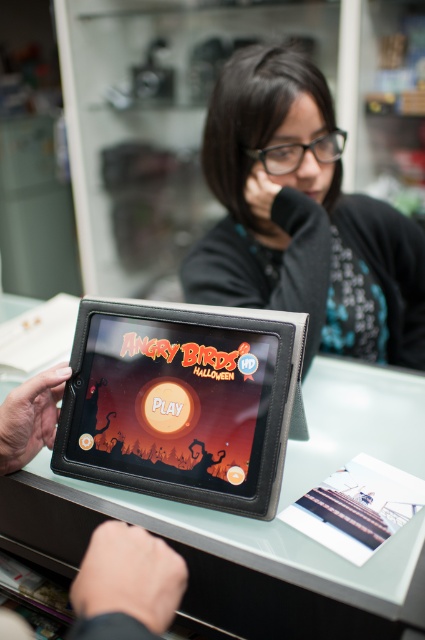
Which is more to the left, black matte jacket at upper center or black leather tablet at center?

From the viewer's perspective, black leather tablet at center appears more on the left side.

Is black matte jacket at upper center taller than black leather tablet at center?

Indeed, black matte jacket at upper center has a greater height compared to black leather tablet at center.

Who is more forward, (224, 268) or (138, 432)?

Point (138, 432)

At what (x,y) coordinates should I click in order to perform the action: click on black matte jacket at upper center. Please return your answer as a coordinate pair (x, y). Looking at the image, I should click on (302, 218).